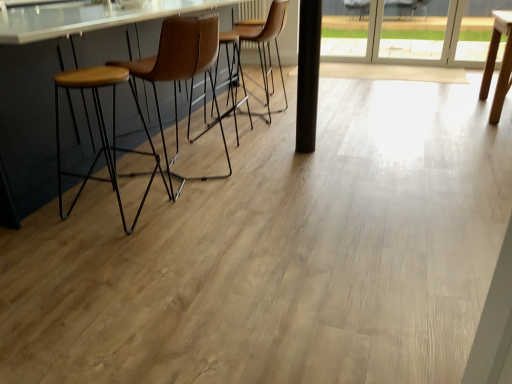
Question: Is point (309, 71) closer or farther from the camera than point (192, 178)?

Choices:
 (A) farther
 (B) closer

Answer: (A)

Question: Considering the relative positions of black matte pole at center and brown leather stool at left, the first chair when ordered from front to back, in the image provided, is black matte pole at center to the left or to the right of brown leather stool at left, the first chair when ordered from front to back,?

Choices:
 (A) left
 (B) right

Answer: (B)

Question: Estimate the real-world distances between objects in this image. Which object is closer to the matte wood counter at left?

Choices:
 (A) transparent glass window at upper right, the 1th window viewed from the right
 (B) black matte pole at center
 (C) transparent glass screen door at upper right
 (D) wooden seat stool at left
 (E) transparent glass door at upper right, which is counted as the 1th window, starting from the left

Answer: (D)

Question: Estimate the real-world distances between objects in this image. Which object is farther from the brown leather chair at center, which is the second chair in front-to-back order?

Choices:
 (A) transparent glass door at upper right, which is counted as the 1th window, starting from the left
 (B) transparent glass screen door at upper right
 (C) black matte pole at center
 (D) transparent glass window at upper right, which is counted as the second window, starting from the left
 (E) wooden seat stool at left

Answer: (D)